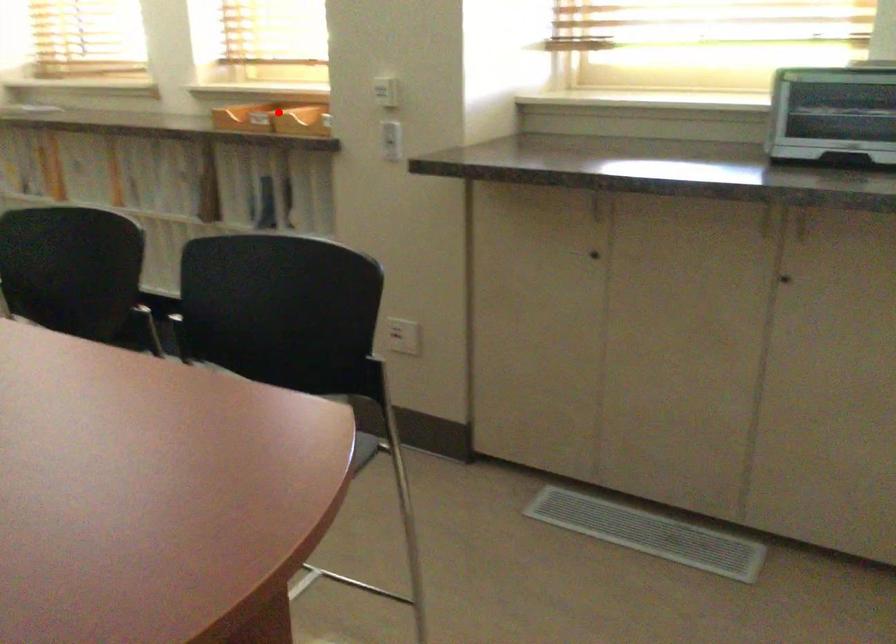
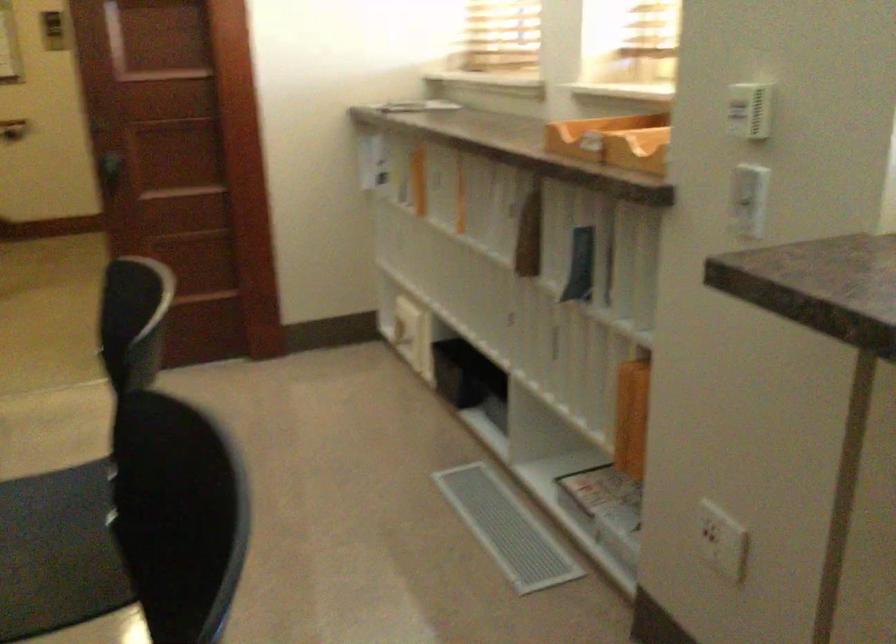
The point at the highlighted location is marked in the first image. Where is the corresponding point in the second image?

(614, 140)